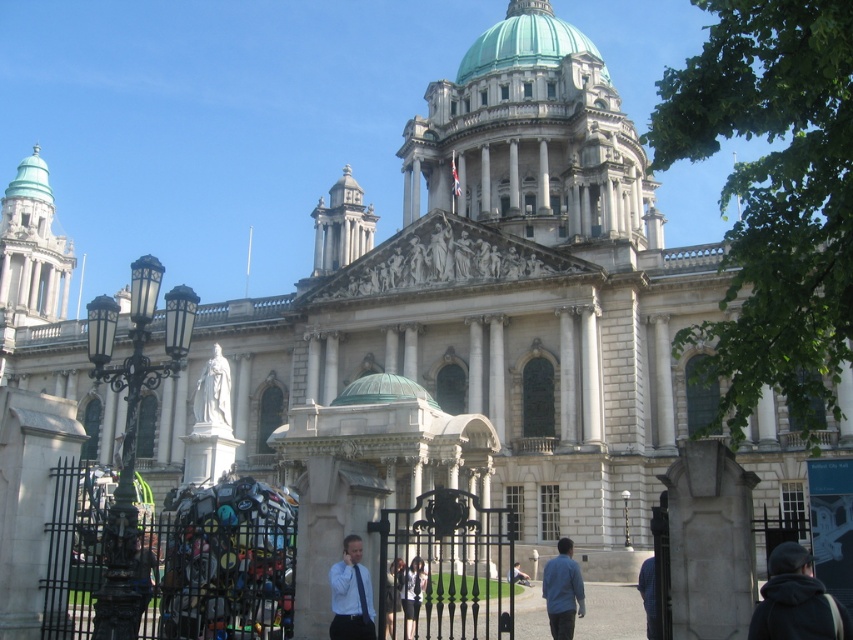
Which of these two, green domed roof at upper center or green copper dome at center, stands shorter?

green copper dome at center is shorter.

Is point (567, 33) positioned before point (370, 385)?

No, (567, 33) is further to viewer.

Find the location of a particular element. Image resolution: width=853 pixels, height=640 pixels. green domed roof at upper center is located at coordinates (523, 42).

Does green domed roof at upper center have a greater height compared to white marble statue at center?

Indeed, green domed roof at upper center has a greater height compared to white marble statue at center.

Consider the image. Who is taller, green domed roof at upper center or white marble statue at center?

With more height is green domed roof at upper center.

What do you see at coordinates (523, 42) in the screenshot? The image size is (853, 640). I see `green domed roof at upper center` at bounding box center [523, 42].

Locate an element on the screen. The image size is (853, 640). green domed roof at upper center is located at coordinates (523, 42).

Is dark gray hoodie at lower right taller than matte white shirt at center?

No.

Is dark gray hoodie at lower right positioned behind matte white shirt at center?

No, it is in front of matte white shirt at center.

This screenshot has width=853, height=640. In order to click on dark gray hoodie at lower right in this screenshot , I will do `click(795, 600)`.

This screenshot has height=640, width=853. Find the location of `dark gray hoodie at lower right`. dark gray hoodie at lower right is located at coordinates (795, 600).